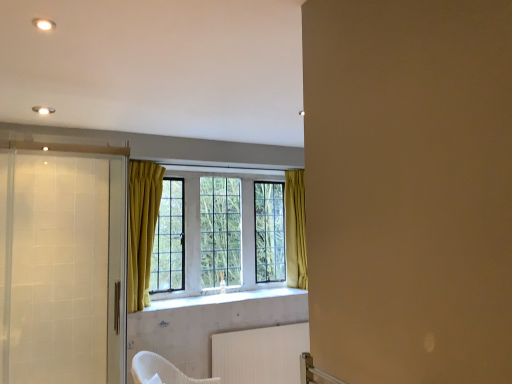
Question: Is white textured radiator at lower center taller than clear glass screen door at left, the 2th screen door when ordered from front to back?

Choices:
 (A) no
 (B) yes

Answer: (A)

Question: Is white textured radiator at lower center with clear glass screen door at left, which appears as the 1th screen door when viewed from the back?

Choices:
 (A) no
 (B) yes

Answer: (A)

Question: Does white textured radiator at lower center lie in front of clear glass screen door at left, the 2th screen door when ordered from front to back?

Choices:
 (A) yes
 (B) no

Answer: (B)

Question: Is white textured radiator at lower center completely or partially outside of clear glass screen door at left, which appears as the 1th screen door when viewed from the back?

Choices:
 (A) no
 (B) yes

Answer: (B)

Question: Can you confirm if white textured radiator at lower center is bigger than clear glass screen door at left, which appears as the 1th screen door when viewed from the back?

Choices:
 (A) yes
 (B) no

Answer: (A)

Question: Considering the positions of clear glass screen door at left, which appears as the 1th screen door when viewed from the back, and translucent glass screen door at left, the 1th screen door viewed from the front, in the image, is clear glass screen door at left, which appears as the 1th screen door when viewed from the back, bigger or smaller than translucent glass screen door at left, the 1th screen door viewed from the front,?

Choices:
 (A) big
 (B) small

Answer: (B)

Question: Which is correct: clear glass screen door at left, which appears as the 1th screen door when viewed from the back, is inside translucent glass screen door at left, the 1th screen door viewed from the front, or outside of it?

Choices:
 (A) outside
 (B) inside

Answer: (A)

Question: From a real-world perspective, is clear glass screen door at left, the 2th screen door when ordered from front to back, physically located above or below translucent glass screen door at left, the 1th screen door viewed from the front?

Choices:
 (A) above
 (B) below

Answer: (B)

Question: Considering their positions, is clear glass screen door at left, which appears as the 1th screen door when viewed from the back, located in front of or behind translucent glass screen door at left, which is the second screen door from back to front?

Choices:
 (A) behind
 (B) front

Answer: (A)

Question: Choose the correct answer: Is clear glass screen door at left, the 2th screen door when ordered from front to back, inside white textured tile at center or outside it?

Choices:
 (A) inside
 (B) outside

Answer: (B)

Question: Looking at their shapes, would you say clear glass screen door at left, the 2th screen door when ordered from front to back, is wider or thinner than white textured tile at center?

Choices:
 (A) wide
 (B) thin

Answer: (B)

Question: Is clear glass screen door at left, which appears as the 1th screen door when viewed from the back, taller or shorter than white textured tile at center?

Choices:
 (A) short
 (B) tall

Answer: (B)

Question: Relative to white textured tile at center, is clear glass screen door at left, the 2th screen door when ordered from front to back, in front or behind?

Choices:
 (A) front
 (B) behind

Answer: (A)

Question: Do you think white textured radiator at lower center is within white textured tile at center, or outside of it?

Choices:
 (A) outside
 (B) inside

Answer: (A)

Question: In terms of size, does white textured radiator at lower center appear bigger or smaller than white textured tile at center?

Choices:
 (A) big
 (B) small

Answer: (A)